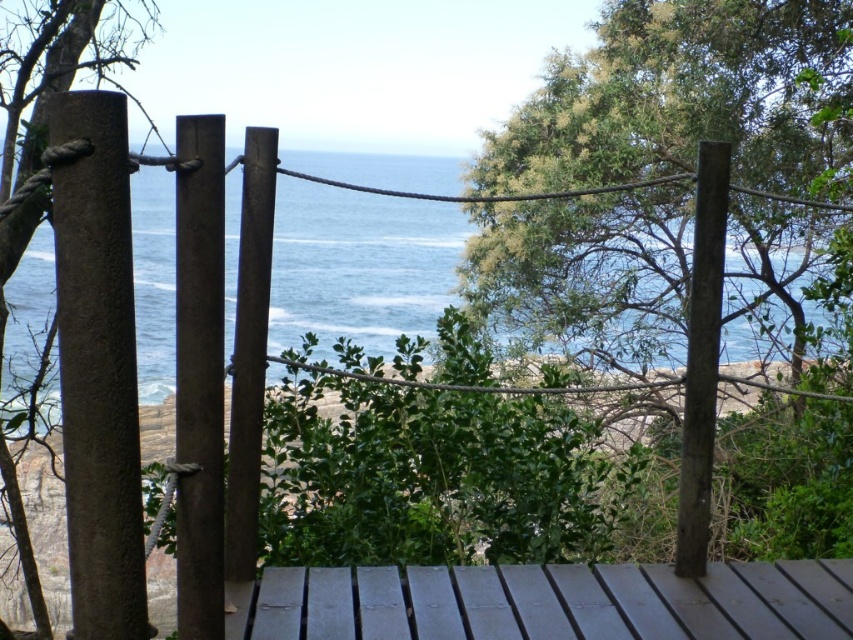
Question: Does green leafy tree at center appear on the right side of green leafy tree at left?

Choices:
 (A) yes
 (B) no

Answer: (A)

Question: Which of these objects is positioned closest to the green leafy tree at center?

Choices:
 (A) smooth dark wood deck at center
 (B) green leafy tree at left

Answer: (A)

Question: Is green leafy tree at center above smooth dark wood deck at center?

Choices:
 (A) no
 (B) yes

Answer: (B)

Question: Does green leafy tree at center appear on the right side of green leafy tree at left?

Choices:
 (A) yes
 (B) no

Answer: (A)

Question: Which point is farther to the camera?

Choices:
 (A) green leafy tree at center
 (B) green leafy tree at left

Answer: (B)

Question: Which is farther from the smooth dark wood deck at center?

Choices:
 (A) green leafy tree at center
 (B) green leafy tree at left

Answer: (A)